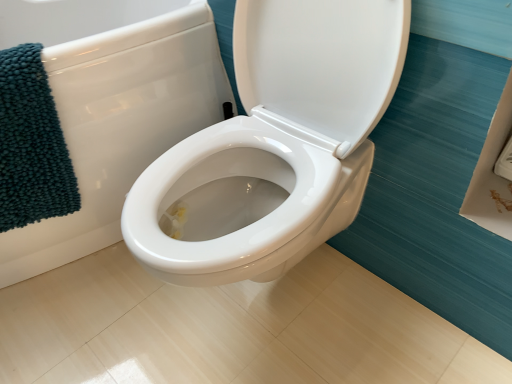
What is the approximate height of white glossy toilet at center?

The height of white glossy toilet at center is 24.09 inches.

The image size is (512, 384). In order to click on white glossy toilet at center in this screenshot , I will do `click(120, 125)`.

This screenshot has width=512, height=384. What do you see at coordinates (120, 125) in the screenshot? I see `white glossy toilet at center` at bounding box center [120, 125].

What is the approximate height of teal chenille bath towel at left?

teal chenille bath towel at left is 15.82 inches in height.

What do you see at coordinates (31, 144) in the screenshot? This screenshot has height=384, width=512. I see `teal chenille bath towel at left` at bounding box center [31, 144].

Identify the location of teal chenille bath towel at left. The height and width of the screenshot is (384, 512). (31, 144).

Find the location of a particular element. white glossy toilet at center is located at coordinates (120, 125).

Considering the positions of objects white glossy toilet at center and teal chenille bath towel at left in the image provided, who is more to the right, white glossy toilet at center or teal chenille bath towel at left?

From the viewer's perspective, teal chenille bath towel at left appears more on the right side.

Is the depth of white glossy toilet at center greater than that of teal chenille bath towel at left?

No, it is not.

Is point (110, 238) positioned after point (18, 222)?

That is True.

Looking at this image, from the image's perspective, is white glossy toilet at center beneath teal chenille bath towel at left?

No.

From a real-world perspective, is white glossy toilet at center above or below teal chenille bath towel at left?

In terms of real-world spatial position, white glossy toilet at center is below teal chenille bath towel at left.

Can you confirm if white glossy toilet at center is thinner than teal chenille bath towel at left?

In fact, white glossy toilet at center might be wider than teal chenille bath towel at left.

Is white glossy toilet at center taller than teal chenille bath towel at left?

Yes, white glossy toilet at center is taller than teal chenille bath towel at left.

From the picture: Which of these two, white glossy toilet at center or teal chenille bath towel at left, is smaller?

teal chenille bath towel at left is smaller.

Is white glossy toilet at center situated inside teal chenille bath towel at left or outside?

white glossy toilet at center is spatially situated outside teal chenille bath towel at left.

Can you see white glossy toilet at center touching teal chenille bath towel at left?

No, white glossy toilet at center is not in contact with teal chenille bath towel at left.

Looking at this image, is white glossy toilet at center turned away from teal chenille bath towel at left?

white glossy toilet at center is not turned away from teal chenille bath towel at left.

You are a GUI agent. You are given a task and a screenshot of the screen. Output one action in this format:
    pyautogui.click(x=<x>, y=<y>)
    Task: Click on the bath on the left of teal chenille bath towel at left
    The width and height of the screenshot is (512, 384).
    Given the screenshot: What is the action you would take?
    pyautogui.click(x=120, y=125)

Considering the relative positions of teal chenille bath towel at left and white glossy toilet at center in the image provided, is teal chenille bath towel at left to the right of white glossy toilet at center from the viewer's perspective?

Yes.

Which object is closer to the camera taking this photo, teal chenille bath towel at left or white glossy toilet at center?

white glossy toilet at center is closer to the camera.

Considering the points (8, 122) and (58, 70), which point is in front, point (8, 122) or point (58, 70)?

The point (8, 122) is in front.

From the image's perspective, is teal chenille bath towel at left beneath white glossy toilet at center?

Yes.

From a real-world perspective, which is physically above, teal chenille bath towel at left or white glossy toilet at center?

teal chenille bath towel at left is physically above.

Between teal chenille bath towel at left and white glossy toilet at center, which one has smaller width?

teal chenille bath towel at left.

Considering the relative sizes of teal chenille bath towel at left and white glossy toilet at center in the image provided, is teal chenille bath towel at left taller than white glossy toilet at center?

Incorrect, the height of teal chenille bath towel at left is not larger of that of white glossy toilet at center.

Who is smaller, teal chenille bath towel at left or white glossy toilet at center?

teal chenille bath towel at left is smaller.

From the picture: Is teal chenille bath towel at left not inside white glossy toilet at center?

No.

Would you say teal chenille bath towel at left is a long distance from white glossy toilet at center?

teal chenille bath towel at left is near white glossy toilet at center, not far away.

Does teal chenille bath towel at left turn towards white glossy toilet at center?

Yes, teal chenille bath towel at left faces towards white glossy toilet at center.

Image resolution: width=512 pixels, height=384 pixels. Identify the location of bath in front of the teal chenille bath towel at left. (120, 125).

Identify the location of bath towel on the right of white glossy toilet at center. (31, 144).

Find the location of `bath towel above the white glossy toilet at center (from a real-world perspective)`. bath towel above the white glossy toilet at center (from a real-world perspective) is located at coordinates (31, 144).